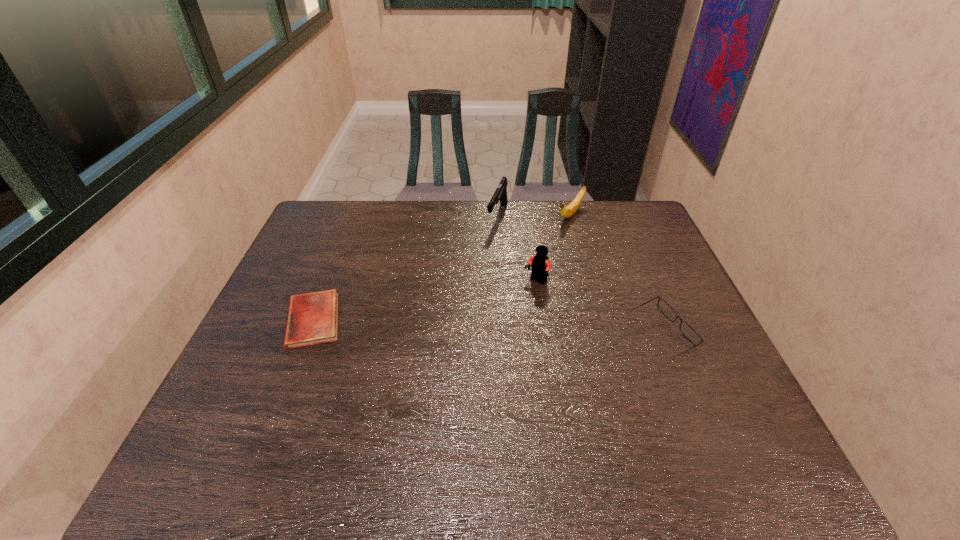
The image size is (960, 540). In order to click on free space located 0.070m on the front-facing side of the third nearest object in this screenshot , I will do `click(516, 301)`.

Locate an element on the screen. vacant area situated 0.090m on the front-facing side of the third nearest object is located at coordinates (511, 305).

You are a GUI agent. You are given a task and a screenshot of the screen. Output one action in this format:
    pyautogui.click(x=<x>, y=<y>)
    Task: Click on the vacant space positioned 0.060m on the front-facing side of the third nearest object
    
    Given the screenshot: What is the action you would take?
    pyautogui.click(x=517, y=299)

Find the location of a particular element. vacant space located 0.140m at the aiming end of the gun is located at coordinates (483, 258).

The image size is (960, 540). Identify the location of free region located 0.180m at the aiming end of the gun. (479, 266).

Where is `vacant area located at the aiming end of the gun`? This screenshot has width=960, height=540. vacant area located at the aiming end of the gun is located at coordinates (471, 283).

The width and height of the screenshot is (960, 540). I want to click on vacant space located at the stem of the banana, so click(555, 233).

The height and width of the screenshot is (540, 960). I want to click on vacant space located 0.270m at the stem of the banana, so click(521, 265).

I want to click on free region located at the stem of the banana, so click(541, 246).

Where is `gun located in the far edge section of the desktop`? This screenshot has width=960, height=540. gun located in the far edge section of the desktop is located at coordinates (500, 193).